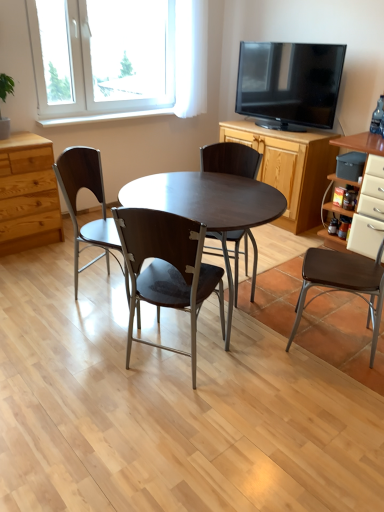
The image size is (384, 512). I want to click on blank space situated above matte dark wood table at center (from a real-world perspective), so click(x=194, y=192).